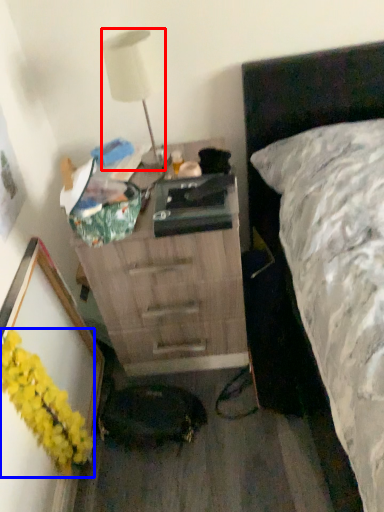
Question: Among these objects, which one is nearest to the camera, lamp (highlighted by a red box) or flower (highlighted by a blue box)?

Choices:
 (A) lamp
 (B) flower

Answer: (B)